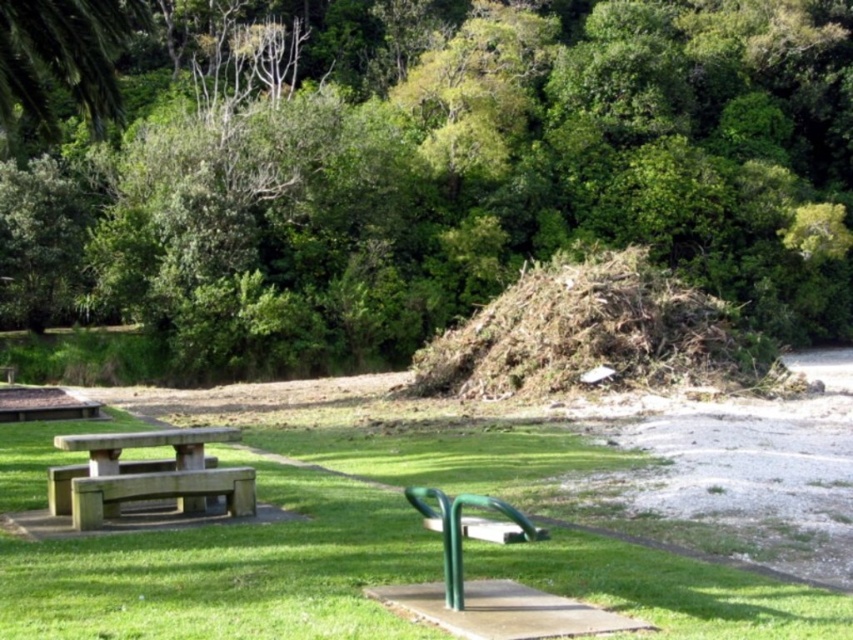
Question: Does wooden picnic table at lower left come behind green concrete bench at lower left?

Choices:
 (A) no
 (B) yes

Answer: (B)

Question: Does green leafy tree at upper center come in front of wooden picnic table at lower left?

Choices:
 (A) no
 (B) yes

Answer: (A)

Question: Which of the following is the farthest from the observer?

Choices:
 (A) (225, 500)
 (B) (505, 509)
 (C) (575, 236)

Answer: (C)

Question: Does green leafy tree at upper center appear on the right side of green concrete bench at lower left?

Choices:
 (A) yes
 (B) no

Answer: (A)

Question: Which of the following is the farthest from the observer?

Choices:
 (A) green grassy at center
 (B) green concrete bench at lower left
 (C) green leafy tree at upper center

Answer: (C)

Question: Among these points, which one is farthest from the camera?

Choices:
 (A) (527, 532)
 (B) (126, 499)
 (C) (318, 221)

Answer: (C)